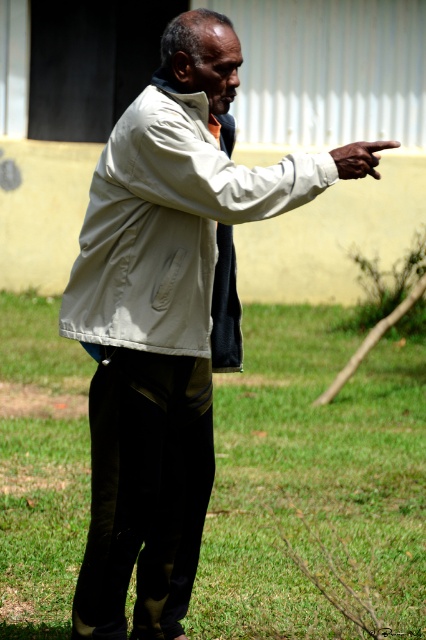
Question: Can you confirm if light beige fabric jacket at center is thinner than white matte hand at upper right?

Choices:
 (A) yes
 (B) no

Answer: (B)

Question: Is green grass at center in front of light beige fabric jacket at center?

Choices:
 (A) no
 (B) yes

Answer: (A)

Question: Which of the following is the closest to the observer?

Choices:
 (A) white matte hand at upper right
 (B) light beige fabric jacket at center

Answer: (A)

Question: Which object is closer to the camera taking this photo?

Choices:
 (A) light beige fabric jacket at center
 (B) green grass at center

Answer: (A)

Question: Among these points, which one is farthest from the camera?

Choices:
 (A) (166, 157)
 (B) (313, 333)

Answer: (B)

Question: Does green grass at center appear under light beige fabric jacket at center?

Choices:
 (A) yes
 (B) no

Answer: (A)